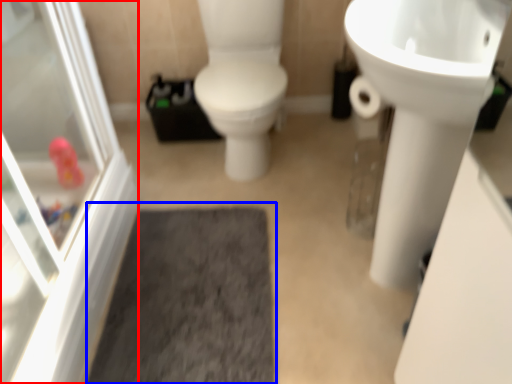
Question: Which of the following is the closest to the observer, screen door (highlighted by a red box) or bath mat (highlighted by a blue box)?

Choices:
 (A) screen door
 (B) bath mat

Answer: (A)